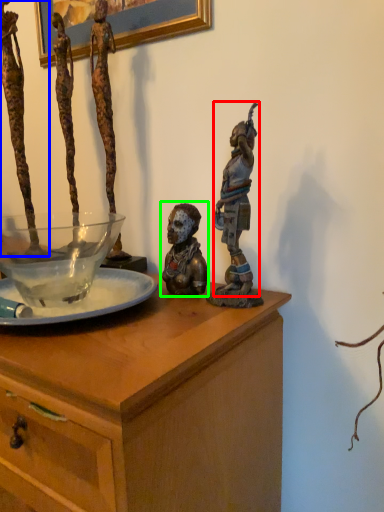
Question: Which object is the farthest from person (highlighted by a red box)? Choose among these: person (highlighted by a blue box) or person (highlighted by a green box).

Choices:
 (A) person
 (B) person

Answer: (A)